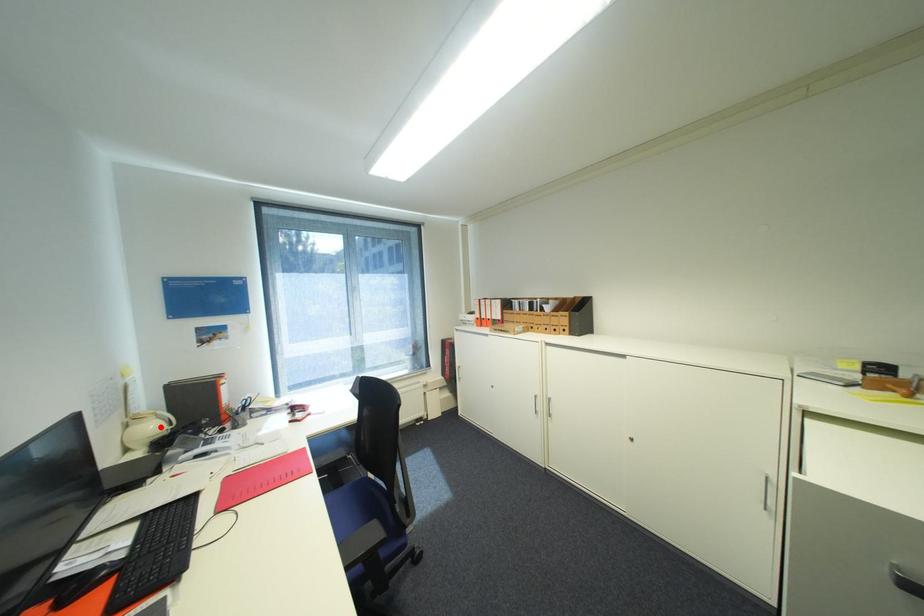
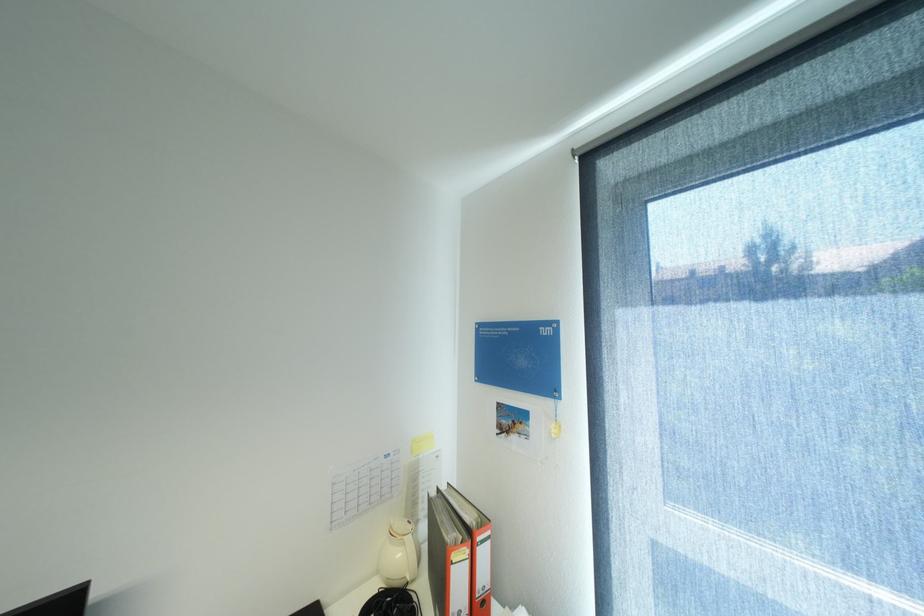
Where in the second image is the point corresponding to the highlighted location from the first image?

(407, 554)